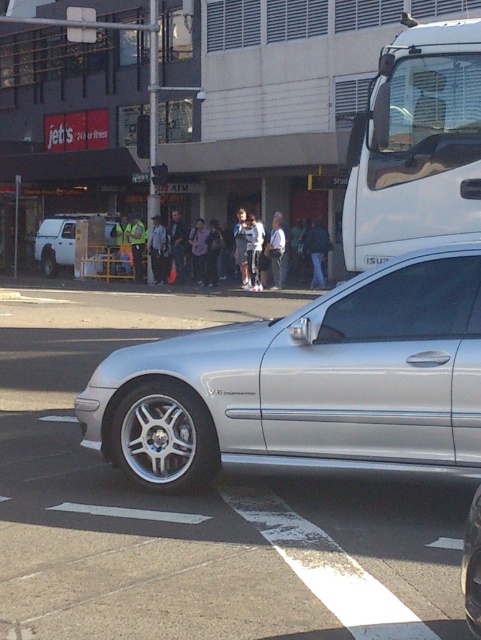
You are a delivery driver who needs to park your vehicle between the white matte van at left and the silver metallic wheel at center. Is there enough vertical space between them to park your van?

The white matte van at left is above the silver metallic wheel at center, so there is insufficient vertical space between them to park your van.

You are a delivery person who needs to park your van next to the silver metallic car at center. The parking space is only 2 meters wide. Can you fit the van next to the car if the silver metallic wheel at lower left is part of the car?

The silver metallic car at center might be wider than silver metallic wheel at lower left. Since the parking space is 2 meters wide, but the car could be wider than the wheel, it is uncertain if the van can fit. Check the car width before deciding.